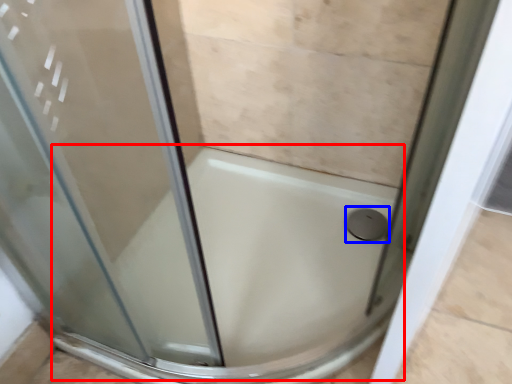
Question: Which object is further to the camera taking this photo, bath (highlighted by a red box) or shower (highlighted by a blue box)?

Choices:
 (A) bath
 (B) shower

Answer: (B)